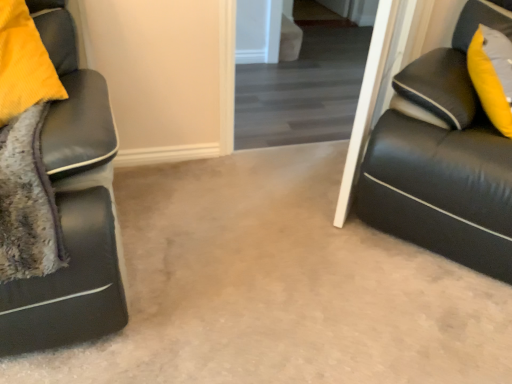
What do you see at coordinates (443, 160) in the screenshot? The image size is (512, 384). I see `matte black couch at right` at bounding box center [443, 160].

Where is `matte black couch at right`? The image size is (512, 384). matte black couch at right is located at coordinates (443, 160).

Describe the element at coordinates (304, 84) in the screenshot. I see `transparent glass door at upper center` at that location.

Where is `transparent glass door at upper center`? transparent glass door at upper center is located at coordinates (304, 84).

Image resolution: width=512 pixels, height=384 pixels. In order to click on matte black couch at right in this screenshot , I will do `click(443, 160)`.

Does transparent glass door at upper center appear on the left side of matte black couch at right?

Correct, you'll find transparent glass door at upper center to the left of matte black couch at right.

Which object is further away from the camera, transparent glass door at upper center or matte black couch at right?

transparent glass door at upper center.

Which point is more forward, (x=256, y=70) or (x=384, y=223)?

Point (x=384, y=223)

From the image's perspective, which is below, transparent glass door at upper center or matte black couch at right?

matte black couch at right is shown below in the image.

From a real-world perspective, which object stands above the other?

matte black couch at right.

Is transparent glass door at upper center wider or thinner than matte black couch at right?

Considering their sizes, transparent glass door at upper center looks slimmer than matte black couch at right.

Which of these two, transparent glass door at upper center or matte black couch at right, stands shorter?

transparent glass door at upper center.

Is transparent glass door at upper center bigger than matte black couch at right?

Actually, transparent glass door at upper center might be smaller than matte black couch at right.

Is transparent glass door at upper center inside or outside of matte black couch at right?

transparent glass door at upper center is not enclosed by matte black couch at right.

Would you consider transparent glass door at upper center to be distant from matte black couch at right?

A: transparent glass door at upper center is far away from matte black couch at right.

Does transparent glass door at upper center turn towards matte black couch at right?

Yes, transparent glass door at upper center is oriented towards matte black couch at right.

Can you tell me how much transparent glass door at upper center and matte black couch at right differ in facing direction?

The facing directions of transparent glass door at upper center and matte black couch at right are 46.1 degrees apart.

Identify the location of studio couch located above the transparent glass door at upper center (from a real-world perspective). The image size is (512, 384). (443, 160).

Is matte black couch at right to the left or to the right of transparent glass door at upper center in the image?

In the image, matte black couch at right appears on the right side of transparent glass door at upper center.

Which object is further away from the camera, matte black couch at right or transparent glass door at upper center?

transparent glass door at upper center.

Which is less distant, (x=497, y=267) or (x=300, y=126)?

The point (x=497, y=267) is in front.

From the image's perspective, which object appears higher, matte black couch at right or transparent glass door at upper center?

transparent glass door at upper center appears higher in the image.

From a real-world perspective, is matte black couch at right over transparent glass door at upper center?

Correct, in the physical world, matte black couch at right is higher than transparent glass door at upper center.

Looking at this image, can you confirm if matte black couch at right is thinner than transparent glass door at upper center?

No.

From the picture: From their relative heights in the image, would you say matte black couch at right is taller or shorter than transparent glass door at upper center?

Clearly, matte black couch at right is taller compared to transparent glass door at upper center.

Does matte black couch at right have a smaller size compared to transparent glass door at upper center?

No.

Would you say transparent glass door at upper center is part of matte black couch at right's contents?

Actually, transparent glass door at upper center is outside matte black couch at right.

Is matte black couch at right next to transparent glass door at upper center and touching it?

There is a gap between matte black couch at right and transparent glass door at upper center.

Based on the photo, is transparent glass door at upper center at the back of matte black couch at right?

No, matte black couch at right's orientation is not away from transparent glass door at upper center.

How many degrees apart are the facing directions of matte black couch at right and transparent glass door at upper center?

The angular difference between matte black couch at right and transparent glass door at upper center is 46.1 degrees.

How distant is matte black couch at right from transparent glass door at upper center?

The distance of matte black couch at right from transparent glass door at upper center is 3.80 feet.

This screenshot has width=512, height=384. Identify the location of glass door behind the matte black couch at right. (304, 84).

Where is `glass door below the matte black couch at right (from a real-world perspective)`? glass door below the matte black couch at right (from a real-world perspective) is located at coordinates (304, 84).

This screenshot has height=384, width=512. Find the location of `studio couch on the right of transparent glass door at upper center`. studio couch on the right of transparent glass door at upper center is located at coordinates (443, 160).